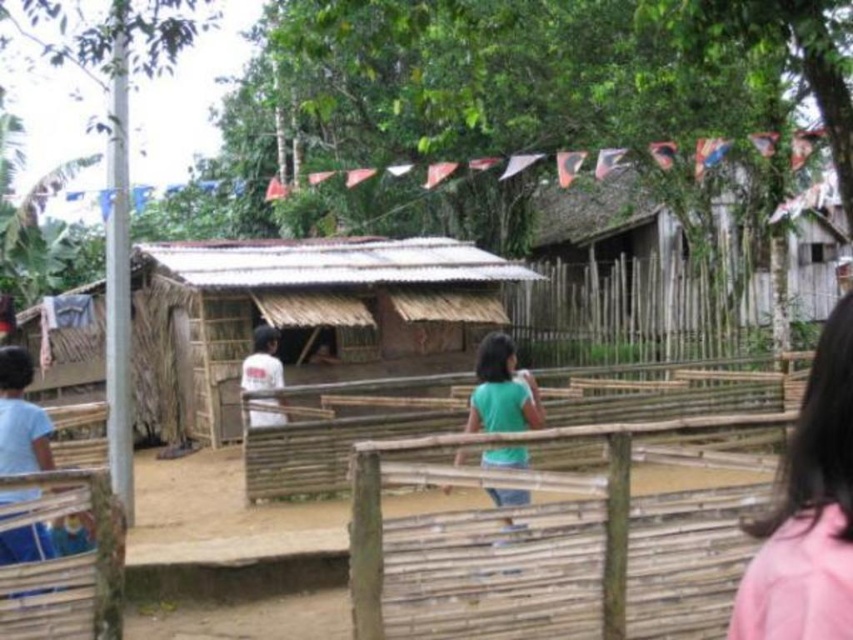
Question: Which is farther from the pink fabric hair at right?

Choices:
 (A) blue cotton shirt at left
 (B) white cotton shirt at center
 (C) brown thatch hut at center
 (D) rustic wooden hut at upper right

Answer: (D)

Question: Does rustic wooden hut at upper right come in front of white cotton shirt at center?

Choices:
 (A) yes
 (B) no

Answer: (B)

Question: Which point appears closest to the camera in this image?

Choices:
 (A) (259, 332)
 (B) (502, 380)
 (C) (640, 291)
 (D) (851, 296)

Answer: (D)

Question: Estimate the real-world distances between objects in this image. Which object is farther from the white cotton shirt at center?

Choices:
 (A) rustic wooden hut at upper right
 (B) pink fabric hair at right
 (C) brown thatch hut at center
 (D) blue cotton shirt at left

Answer: (A)

Question: Does brown thatch hut at center have a larger size compared to white cotton shirt at center?

Choices:
 (A) yes
 (B) no

Answer: (A)

Question: Can you confirm if pink fabric hair at right is thinner than green matte shirt at center?

Choices:
 (A) yes
 (B) no

Answer: (A)